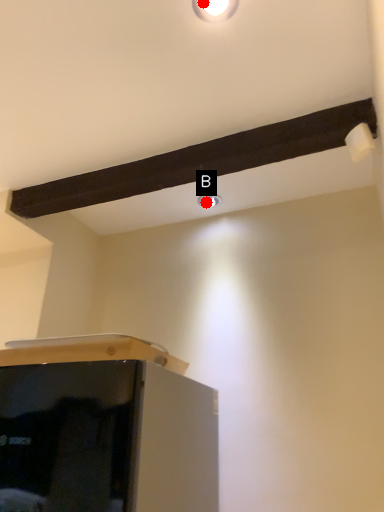
Question: Two points are circled on the image, labeled by A and B beside each circle. Which point is farther from the camera taking this photo?

Choices:
 (A) A is further
 (B) B is further

Answer: (B)